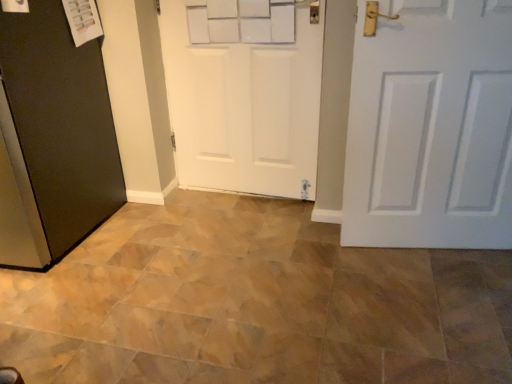
Locate an element on the screen. The image size is (512, 384). free space on the front side of white matte door at center, which is the 3th door from left to right is located at coordinates (436, 301).